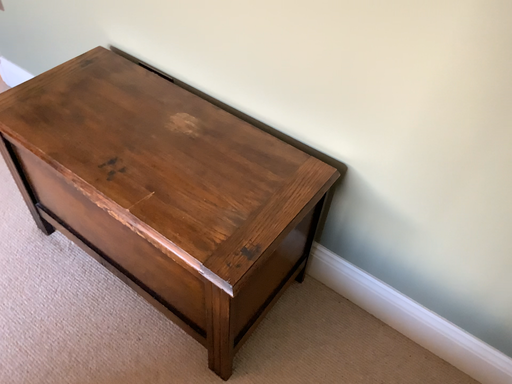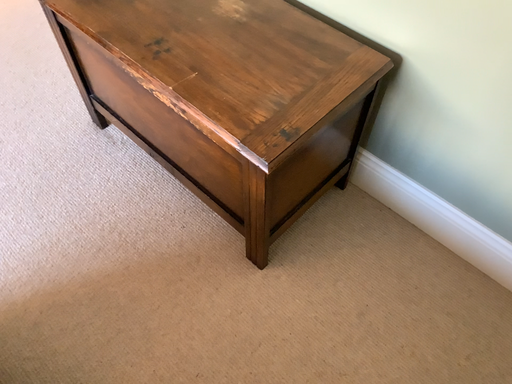
Question: Which way did the camera rotate in the video?

Choices:
 (A) rotated downward
 (B) rotated upward

Answer: (A)